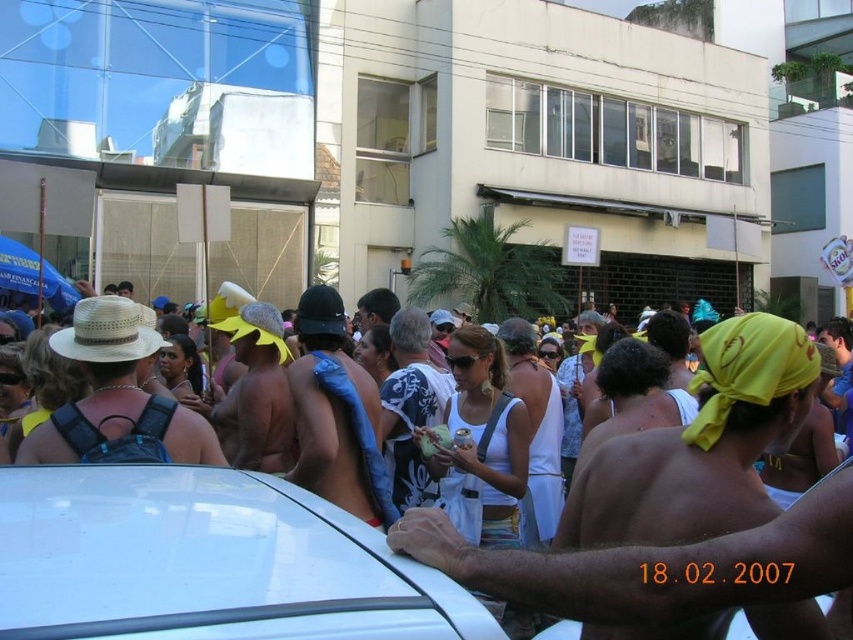
Question: Among these objects, which one is nearest to the camera?

Choices:
 (A) blue fabric at center
 (B) shiny metallic tank top at center
 (C) yellow fabric headscarf at center-right

Answer: (C)

Question: Is yellow fabric headscarf at center-right behind shiny metallic tank top at center?

Choices:
 (A) no
 (B) yes

Answer: (A)

Question: Can you confirm if blue fabric at center is positioned to the left of shiny metallic tank top at center?

Choices:
 (A) yes
 (B) no

Answer: (B)

Question: From the image, what is the correct spatial relationship of white glossy car at lower left in relation to yellow fabric headscarf at center-right?

Choices:
 (A) left
 (B) right

Answer: (A)

Question: Estimate the real-world distances between objects in this image. Which object is closer to the shiny metallic tank top at center?

Choices:
 (A) white glossy car at lower left
 (B) yellow fabric headscarf at center-right
 (C) white printed shirt at center
 (D) blue fabric at center

Answer: (C)

Question: Which point is closer to the camera?

Choices:
 (A) (595, 625)
 (B) (32, 483)
 (C) (392, 504)

Answer: (B)